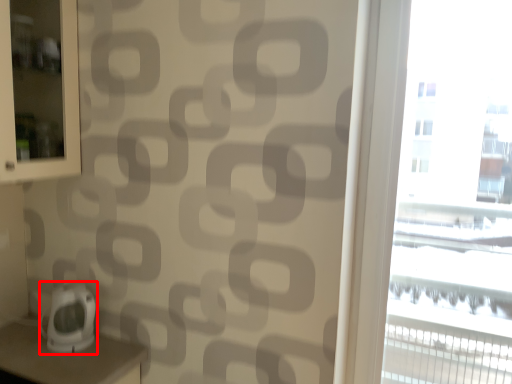
Question: Considering the relative positions of appliance (annotated by the red box) and window in the image provided, where is appliance (annotated by the red box) located with respect to the staircase?

Choices:
 (A) left
 (B) right

Answer: (A)